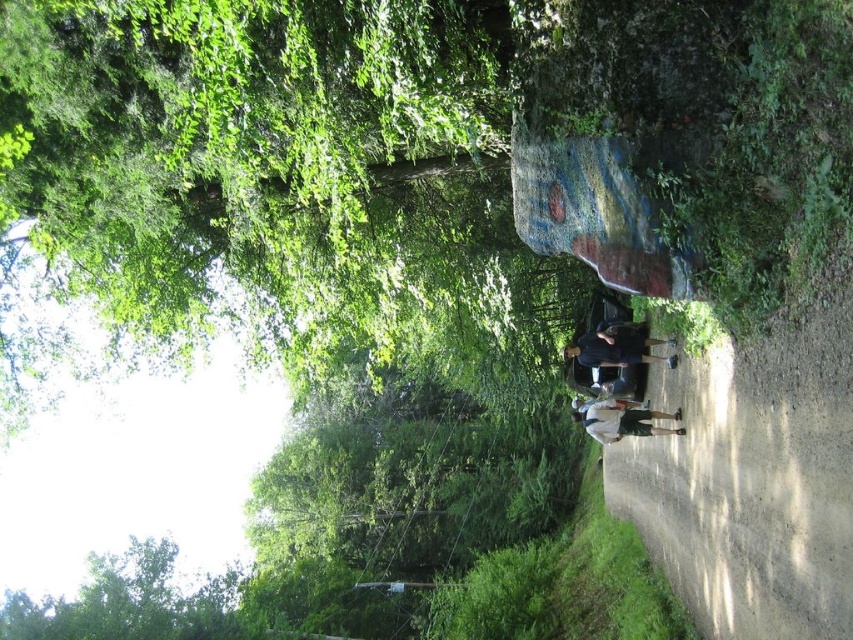
Who is positioned more to the left, black matte shirt at center or white cotton shirt at center?

Positioned to the left is white cotton shirt at center.

Describe the element at coordinates (613, 352) in the screenshot. I see `black matte shirt at center` at that location.

Identify the location of black matte shirt at center. The image size is (853, 640). (613, 352).